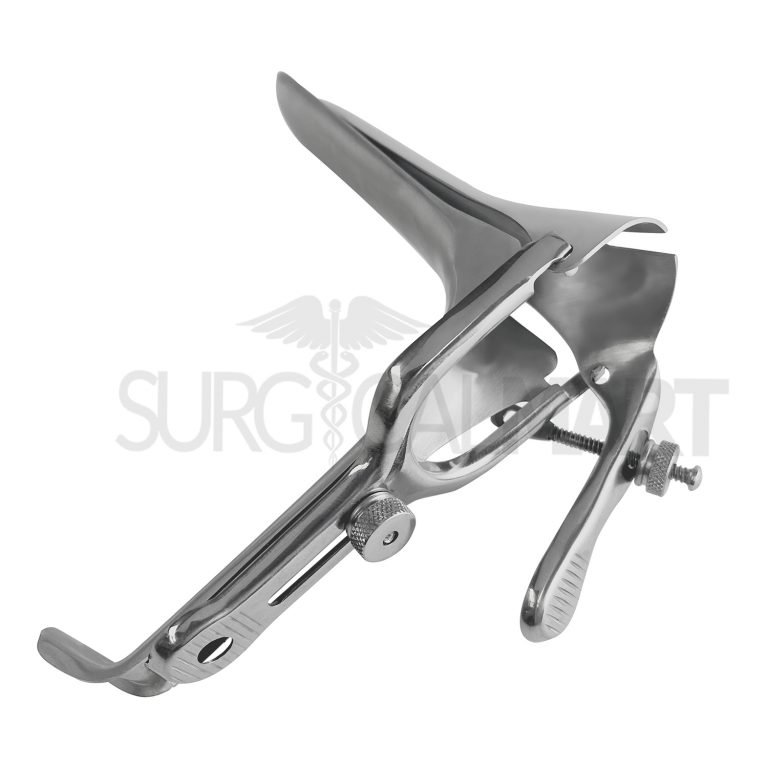
Identify the location of screws. The image size is (768, 768). (657, 477), (376, 518).